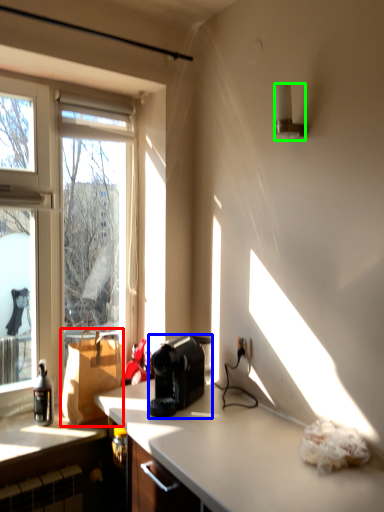
Question: Which object is the closest to the cardboard box (highlighted by a red box)? Choose among these: coffee maker (highlighted by a blue box) or lamp (highlighted by a green box).

Choices:
 (A) coffee maker
 (B) lamp

Answer: (A)